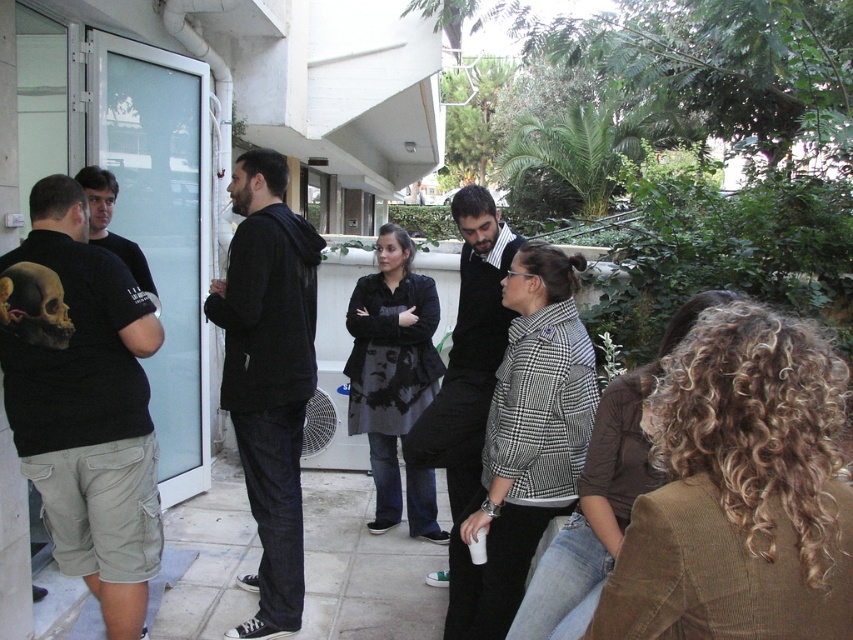
You are standing at the point with coordinates (83, 401). What object are you currently standing on?

You are standing on the black matte t shirt at left.

You are organizing a charity clothing drive and need to categorize hoodies by size. You have two hoodies to sort today. The first is the black cotton hoodie at center, and the second is the matte black hoodie at left. Which hoodie should you place in the large size bin?

The black cotton hoodie at center has a larger size compared to the matte black hoodie at left, so you should place the black cotton hoodie at center in the large size bin.